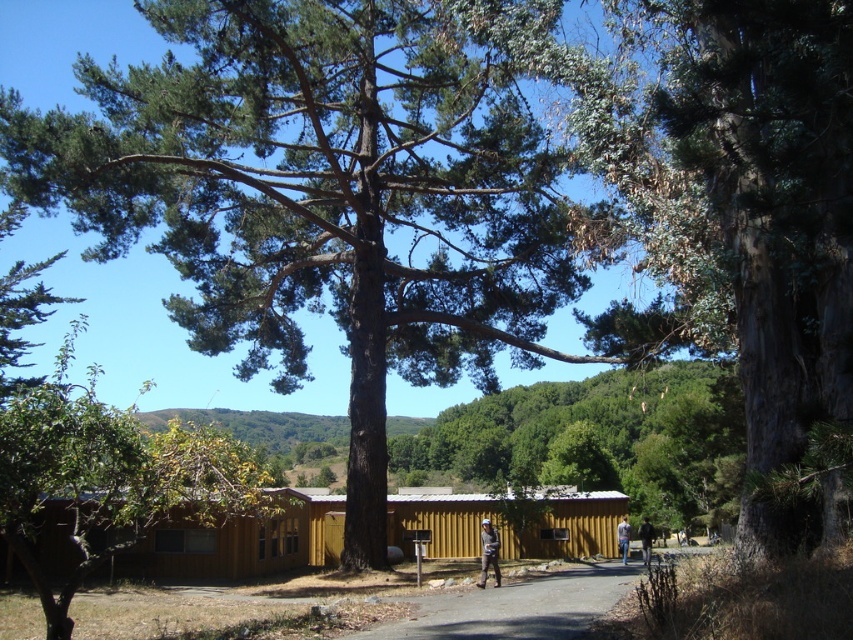
Locate an element on the screen. The width and height of the screenshot is (853, 640). green textured tree at center is located at coordinates (326, 193).

Who is lower down, green textured tree at center or dark blue jeans at lower right?

dark blue jeans at lower right is below.

Describe the element at coordinates (326, 193) in the screenshot. I see `green textured tree at center` at that location.

Where is `green textured tree at center`? green textured tree at center is located at coordinates (326, 193).

Does wooden cabin at center have a greater height compared to gray asphalt path at center?

In fact, wooden cabin at center may be shorter than gray asphalt path at center.

Is point (505, 556) closer to viewer compared to point (469, 624)?

No.

The width and height of the screenshot is (853, 640). What do you see at coordinates (508, 524) in the screenshot?
I see `wooden cabin at center` at bounding box center [508, 524].

In order to click on wooden cabin at center in this screenshot , I will do `click(508, 524)`.

Can you confirm if wooden cabin at center is taller than dark blue jeans at lower right?

No, wooden cabin at center is not taller than dark blue jeans at lower right.

Is wooden cabin at center further to the viewer compared to dark blue jeans at lower right?

Yes.

This screenshot has height=640, width=853. What do you see at coordinates (508, 524) in the screenshot? I see `wooden cabin at center` at bounding box center [508, 524].

Image resolution: width=853 pixels, height=640 pixels. I want to click on wooden cabin at center, so click(508, 524).